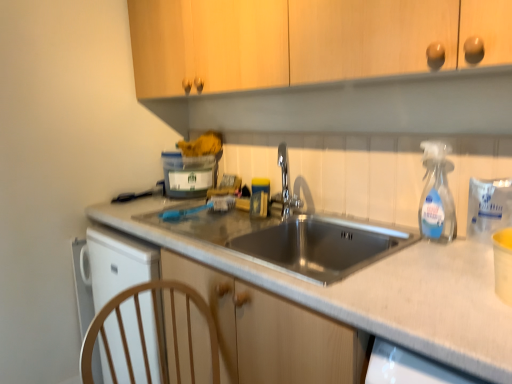
The height and width of the screenshot is (384, 512). Identify the location of free space in front of clear plastic spray bottle at right. (434, 253).